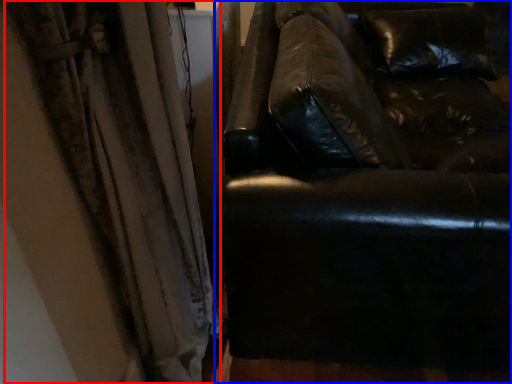
Question: Which point is further to the camera, curtain (highlighted by a red box) or studio couch (highlighted by a blue box)?

Choices:
 (A) curtain
 (B) studio couch

Answer: (B)